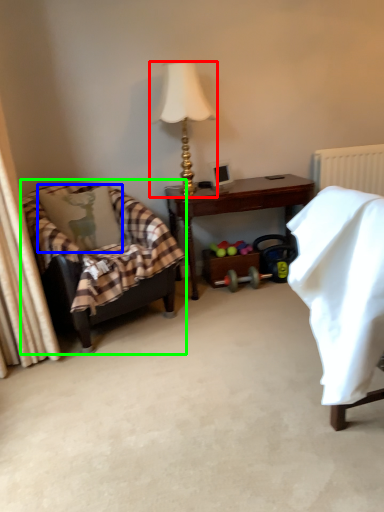
Question: Which object is positioned farthest from lamp (highlighted by a red box)? Select from pillow (highlighted by a blue box) and chair (highlighted by a green box).

Choices:
 (A) pillow
 (B) chair

Answer: (B)